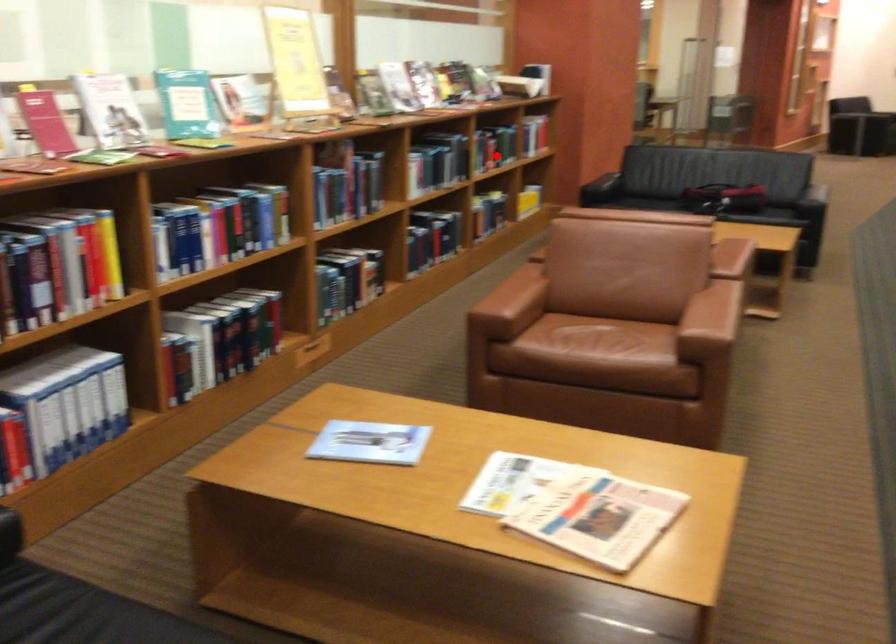
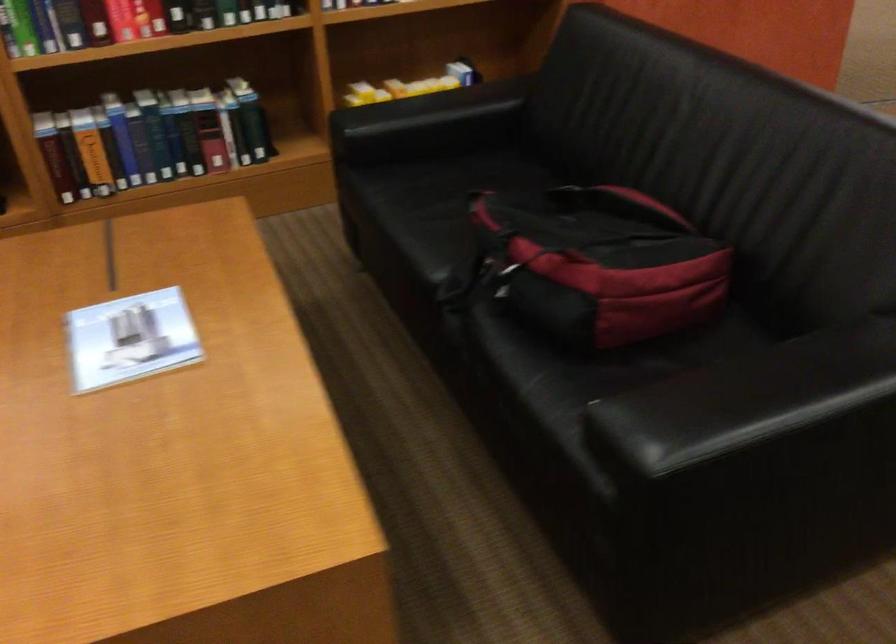
The point at the highlighted location is marked in the first image. Where is the corresponding point in the second image?

(123, 21)